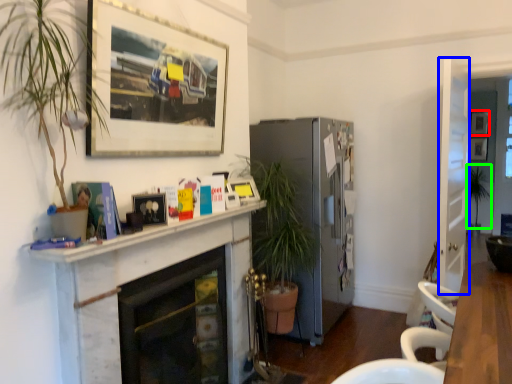
Question: Considering the real-world distances, which object is closest to picture frame (highlighted by a red box)? glass door (highlighted by a blue box) or plant (highlighted by a green box).

Choices:
 (A) glass door
 (B) plant

Answer: (B)